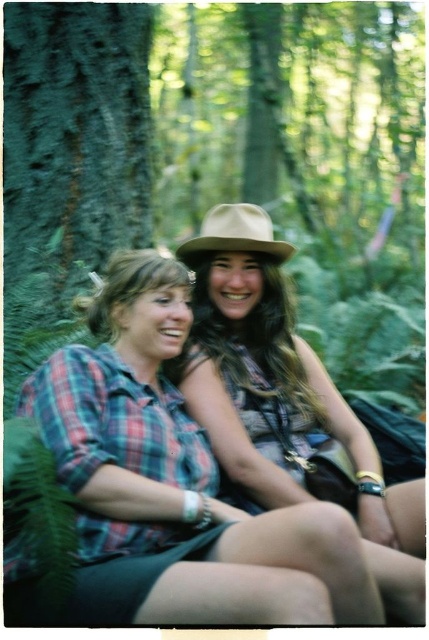
Between matte brown hat at center and brown felt fedora at center, which one is positioned lower?

matte brown hat at center

Between matte brown hat at center and brown felt fedora at center, which one appears on the right side from the viewer's perspective?

From the viewer's perspective, matte brown hat at center appears more on the right side.

The width and height of the screenshot is (429, 640). What are the coordinates of `matte brown hat at center` in the screenshot? It's located at [x=283, y=397].

Locate an element on the screen. This screenshot has width=429, height=640. matte brown hat at center is located at coordinates (283, 397).

Is green rough bark at left smaller than matte brown hat at center?

No, green rough bark at left is not smaller than matte brown hat at center.

Which is behind, point (71, 253) or point (235, 339)?

The point (71, 253) is behind.

In order to click on green rough bark at left in this screenshot , I will do `click(69, 157)`.

Who is taller, plaid fabric shirt at center or matte brown hat at center?

With more height is matte brown hat at center.

Is plaid fabric shirt at center further to the viewer compared to matte brown hat at center?

No, it is in front of matte brown hat at center.

Describe the element at coordinates (175, 483) in the screenshot. The image size is (429, 640). I see `plaid fabric shirt at center` at that location.

Where is `plaid fabric shirt at center`? This screenshot has height=640, width=429. plaid fabric shirt at center is located at coordinates click(x=175, y=483).